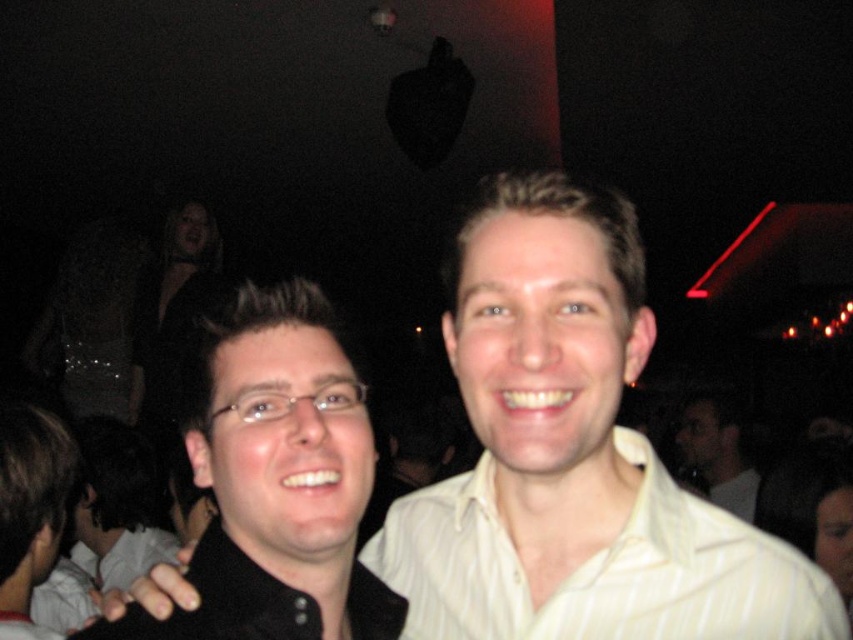
You are a photographer trying to capture both the matte black shirt at center and the white striped dress shirt at center in a single frame. Considering their sizes, which one should you focus on to ensure both are clearly visible?

Since the matte black shirt at center is smaller than the white striped dress shirt at center, you should focus on the white striped dress shirt at center to ensure both are clearly visible in the frame.

You are taking a photo of two points in the image. The first point is labeled as point (56, 442) and the second is point (737, 481). If you want to focus on the point that is closer to the camera, which coordinate should you adjust your camera to focus on?

Point (56, 442) is closer to the camera than point (737, 481), so you should focus on point (56, 442).

You are a photographer adjusting the camera focus. The scene has two main subjects in the foreground. The black glossy hair at left and the light beige shirt at center. Which object should you focus on to ensure the subject in the foreground is sharp?

The black glossy hair at left is positioned over light beige shirt at center, so focusing on the black glossy hair at left will ensure the foreground subject is sharp.